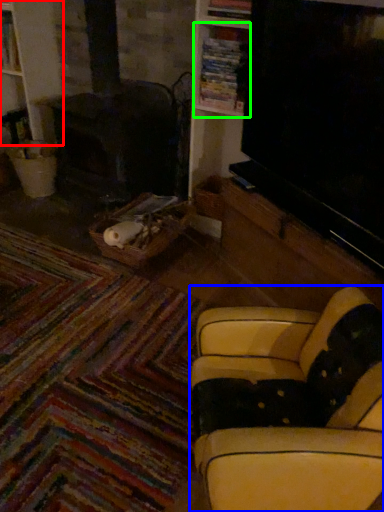
Question: Estimate the real-world distances between objects in this image. Which object is farther from bookshelf (highlighted by a red box), studio couch (highlighted by a blue box) or shelf (highlighted by a green box)?

Choices:
 (A) studio couch
 (B) shelf

Answer: (A)